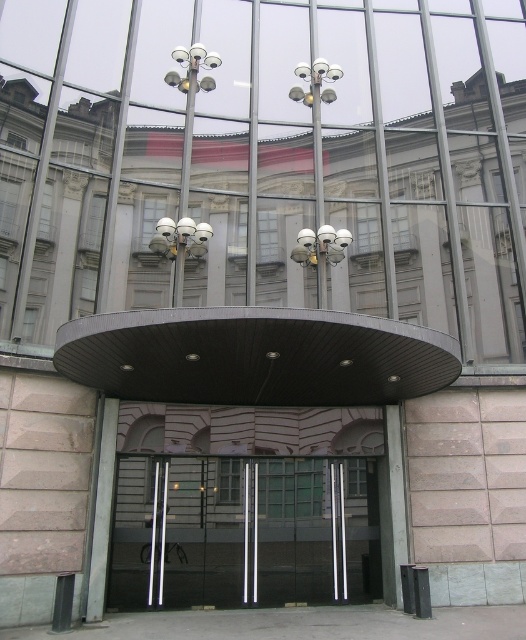
Question: Is transparent glass door at center closer to camera compared to matte silver lamp at upper center?

Choices:
 (A) yes
 (B) no

Answer: (A)

Question: Is transparent glass door at center in front of sleek metallic security cameras at center?

Choices:
 (A) no
 (B) yes

Answer: (B)

Question: Can you confirm if white plastic cameras at center is positioned to the right of metallic dome at center?

Choices:
 (A) no
 (B) yes

Answer: (B)

Question: Which object is closer to the camera taking this photo?

Choices:
 (A) transparent glass door at center
 (B) matte silver lamp at upper center
 (C) metallic dome at center
 (D) sleek metallic security cameras at center

Answer: (A)

Question: Which is nearer to the sleek metallic security cameras at center?

Choices:
 (A) metallic dome at center
 (B) transparent glass door at center
 (C) white plastic cameras at center
 (D) matte silver lamp at upper center

Answer: (C)

Question: Which object is positioned farthest from the sleek metallic security cameras at center?

Choices:
 (A) matte silver lamp at upper center
 (B) transparent glass door at center
 (C) white plastic cameras at center

Answer: (B)